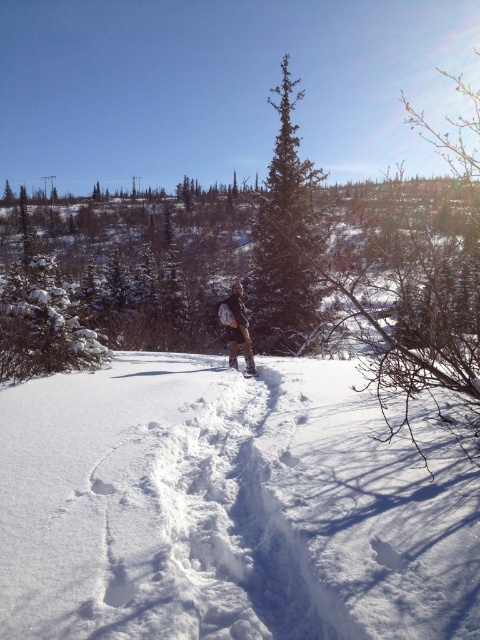
This screenshot has width=480, height=640. I want to click on white fluffy snow at center, so click(227, 509).

Is white fluffy snow at center further to the viewer compared to brown fabric backpack at center?

No, it is not.

Which is in front, point (282, 481) or point (242, 323)?

Point (282, 481)

The height and width of the screenshot is (640, 480). In order to click on white fluffy snow at center in this screenshot , I will do `click(227, 509)`.

Does point (289, 83) come closer to viewer compared to point (243, 310)?

No.

Between green coniferous tree at center and brown fabric backpack at center, which one appears on the left side from the viewer's perspective?

brown fabric backpack at center is more to the left.

Who is more distant from viewer, (260, 269) or (238, 317)?

The point (260, 269) is more distant.

In order to click on green coniferous tree at center in this screenshot , I will do `click(286, 241)`.

Between green coniferous tree at center and white rubber snowshoe at center, which one appears on the left side from the viewer's perspective?

Positioned to the left is white rubber snowshoe at center.

Between green coniferous tree at center and white rubber snowshoe at center, which one appears on the right side from the viewer's perspective?

From the viewer's perspective, green coniferous tree at center appears more on the right side.

Who is more distant from viewer, (284, 88) or (252, 371)?

Point (284, 88)

Identify the location of green coniferous tree at center. (286, 241).